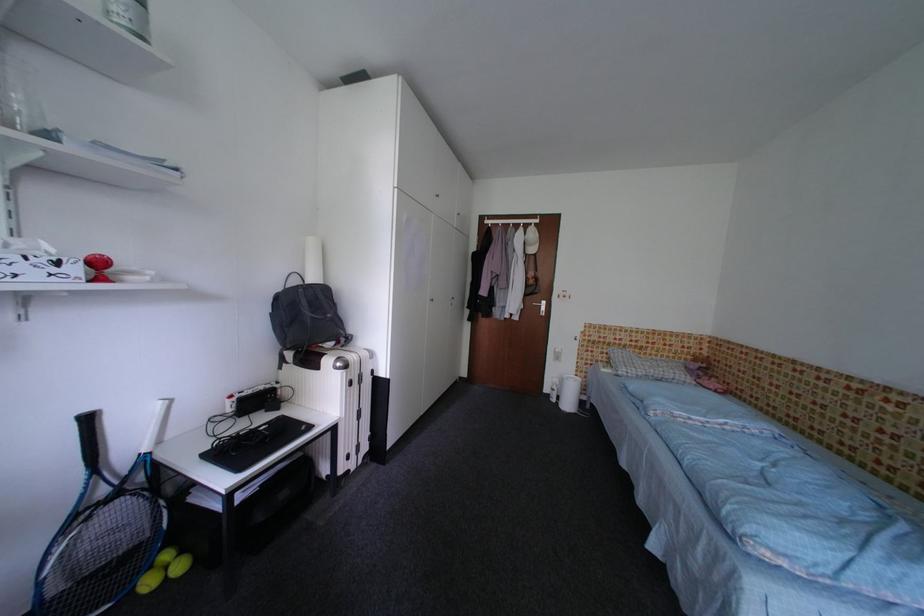
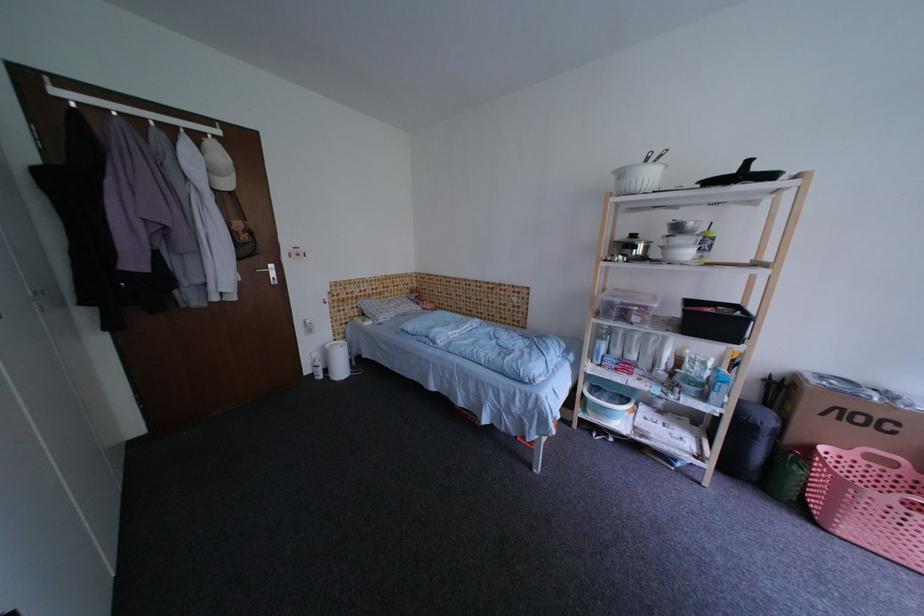
Locate, in the second image, the point that corresponds to the point at 553,392 in the first image.

(314, 374)